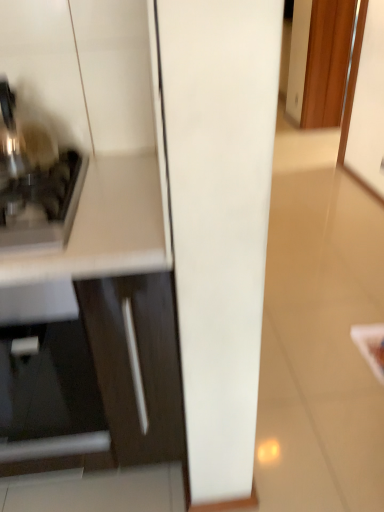
In order to face matte white cabinet at left, should I rotate leftwards or rightwards?

Turn left by 18.472 degrees to look at matte white cabinet at left.

What is the approximate width of matte white cabinet at left?

matte white cabinet at left is 23.84 inches wide.

Describe the element at coordinates (95, 382) in the screenshot. The width and height of the screenshot is (384, 512). I see `matte white cabinet at left` at that location.

I want to click on matte white cabinet at left, so point(95,382).

Where is `satin silver toaster at left`? satin silver toaster at left is located at coordinates (42, 205).

Describe the element at coordinates (42, 205) in the screenshot. The height and width of the screenshot is (512, 384). I see `satin silver toaster at left` at that location.

Measure the distance between point (47, 178) and camera.

The depth of point (47, 178) is 1.08 meters.

Locate an element on the screen. This screenshot has height=512, width=384. matte white cabinet at left is located at coordinates (95, 382).

Can you confirm if satin silver toaster at left is positioned to the left of matte white cabinet at left?

In fact, satin silver toaster at left is to the right of matte white cabinet at left.

Which object is more forward, satin silver toaster at left or matte white cabinet at left?

matte white cabinet at left.

Is point (3, 228) positioned before point (168, 296)?

That is True.

From the image's perspective, between satin silver toaster at left and matte white cabinet at left, which one is located above?

satin silver toaster at left appears higher in the image.

From a real-world perspective, is satin silver toaster at left located beneath matte white cabinet at left?

No, from a real-world perspective, satin silver toaster at left is not beneath matte white cabinet at left.

Which object is thinner, satin silver toaster at left or matte white cabinet at left?

satin silver toaster at left.

Between satin silver toaster at left and matte white cabinet at left, which one has less height?

Standing shorter between the two is satin silver toaster at left.

Who is smaller, satin silver toaster at left or matte white cabinet at left?

With smaller size is satin silver toaster at left.

Is satin silver toaster at left not within matte white cabinet at left?

No, satin silver toaster at left is inside or overlapping with matte white cabinet at left.

Is there a large distance between satin silver toaster at left and matte white cabinet at left?

No, there isn't a large distance between satin silver toaster at left and matte white cabinet at left.

Could you tell me if satin silver toaster at left is turned towards matte white cabinet at left?

No, satin silver toaster at left is not oriented towards matte white cabinet at left.

In the scene shown: How many degrees apart are the facing directions of satin silver toaster at left and matte white cabinet at left?

0.531 degrees separate the facing orientations of satin silver toaster at left and matte white cabinet at left.

Based on the photo, measure the distance between satin silver toaster at left and matte white cabinet at left.

satin silver toaster at left and matte white cabinet at left are 14.37 inches apart.

Where is `cabinetry below the satin silver toaster at left (from a real-world perspective)`? This screenshot has height=512, width=384. cabinetry below the satin silver toaster at left (from a real-world perspective) is located at coordinates tap(95, 382).

Based on their positions, is matte white cabinet at left located to the left or right of satin silver toaster at left?

In the image, matte white cabinet at left appears on the left side of satin silver toaster at left.

Relative to satin silver toaster at left, is matte white cabinet at left in front or behind?

Visually, matte white cabinet at left is located in front of satin silver toaster at left.

Between point (145, 442) and point (71, 183), which one is positioned in front?

The point (71, 183) is closer to the camera.

From the image's perspective, which object appears higher, matte white cabinet at left or satin silver toaster at left?

satin silver toaster at left is shown above in the image.

From a real-world perspective, between matte white cabinet at left and satin silver toaster at left, who is vertically higher?

satin silver toaster at left, from a real-world perspective.

Which of these two, matte white cabinet at left or satin silver toaster at left, is wider?

With larger width is matte white cabinet at left.

Can you confirm if matte white cabinet at left is shorter than satin silver toaster at left?

Incorrect, the height of matte white cabinet at left does not fall short of that of satin silver toaster at left.

Between matte white cabinet at left and satin silver toaster at left, which one has larger size?

Bigger between the two is matte white cabinet at left.

Looking at this image, is satin silver toaster at left inside matte white cabinet at left?

Indeed, satin silver toaster at left is located within matte white cabinet at left.

Are matte white cabinet at left and satin silver toaster at left far apart?

No, matte white cabinet at left is not far from satin silver toaster at left.

Is matte white cabinet at left oriented towards satin silver toaster at left?

No, matte white cabinet at left is not facing towards satin silver toaster at left.

How different are the orientations of matte white cabinet at left and satin silver toaster at left in degrees?

matte white cabinet at left and satin silver toaster at left are facing 0.531 degrees away from each other.

Measure the distance from matte white cabinet at left to satin silver toaster at left.

matte white cabinet at left is 14.37 inches from satin silver toaster at left.

At what (x,y) coordinates should I click in order to perform the action: click on cabinetry below the satin silver toaster at left (from the image's perspective). Please return your answer as a coordinate pair (x, y). The height and width of the screenshot is (512, 384). Looking at the image, I should click on (95, 382).

The image size is (384, 512). In the image, there is a satin silver toaster at left. In order to click on cabinetry below it (from the image's perspective) in this screenshot , I will do `click(95, 382)`.

In the image, there is a matte white cabinet at left. Find the location of `home appliance above it (from the image's perspective)`. home appliance above it (from the image's perspective) is located at coordinates (42, 205).